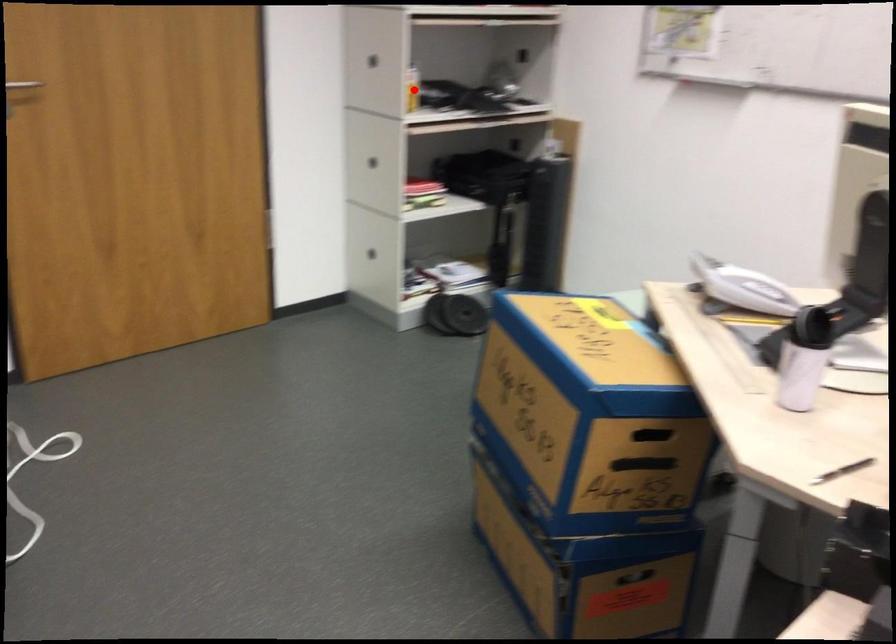
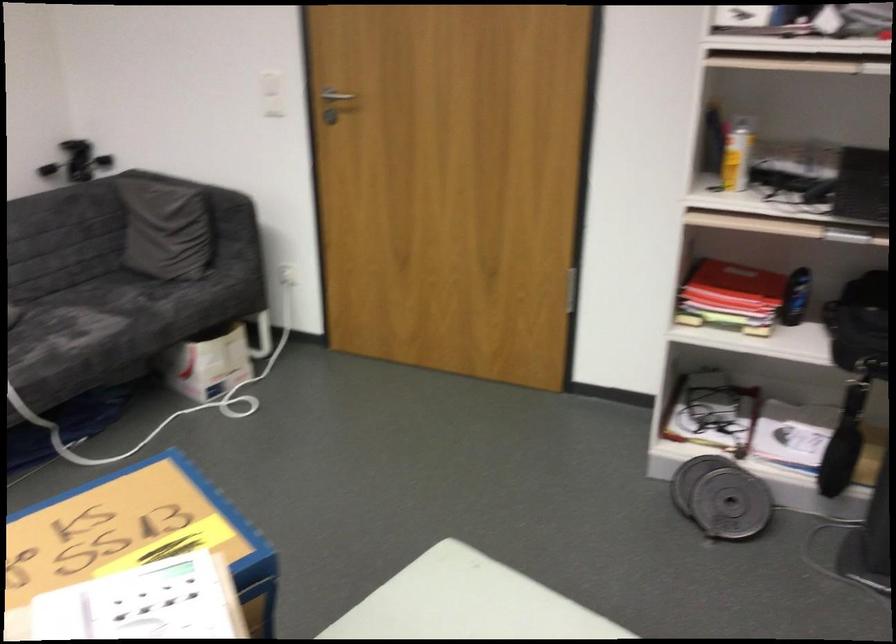
Locate, in the second image, the point that corresponds to the highlighted location in the first image.

(736, 158)